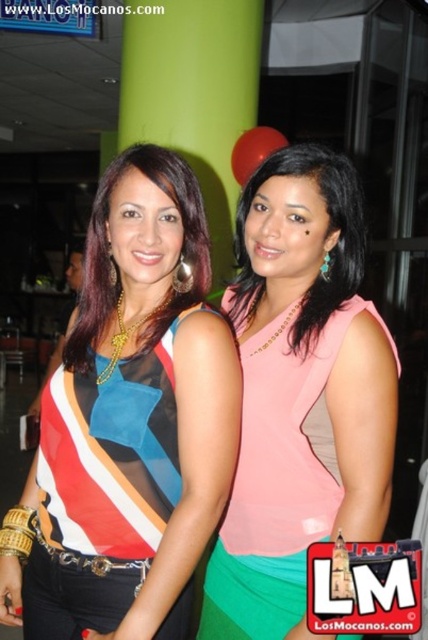
You are a photographer at an event and want to ensure both the pink fabric dress at center and the matte multicolored top at center are fully visible in the photo. Based on their widths, which one might require more space in the frame?

The pink fabric dress at center might require more space in the frame since it is wider than the matte multicolored top at center according to the description.